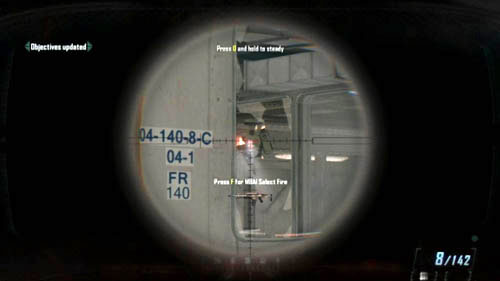
You are a GUI agent. You are given a task and a screenshot of the screen. Output one action in this format:
    pyautogui.click(x=<x>, y=<y>)
    Task: Click on the cement wall
    The height and width of the screenshot is (281, 500).
    Given the screenshot: What is the action you would take?
    pyautogui.click(x=325, y=179)